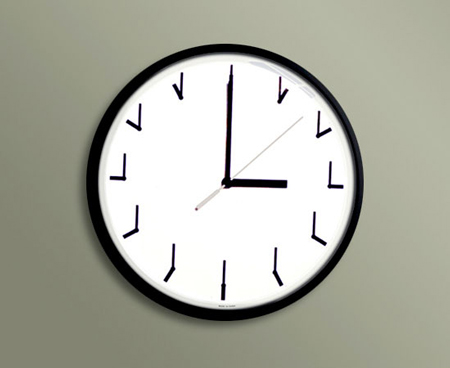
Locate an element on the screen. second hand of clock is located at coordinates (262, 151).